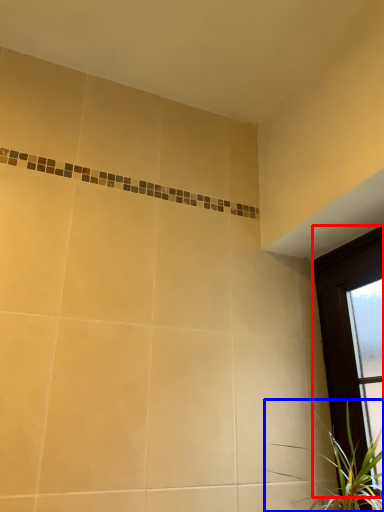
Question: Which object is closer to the camera taking this photo, window (highlighted by a red box) or houseplant (highlighted by a blue box)?

Choices:
 (A) window
 (B) houseplant

Answer: (B)